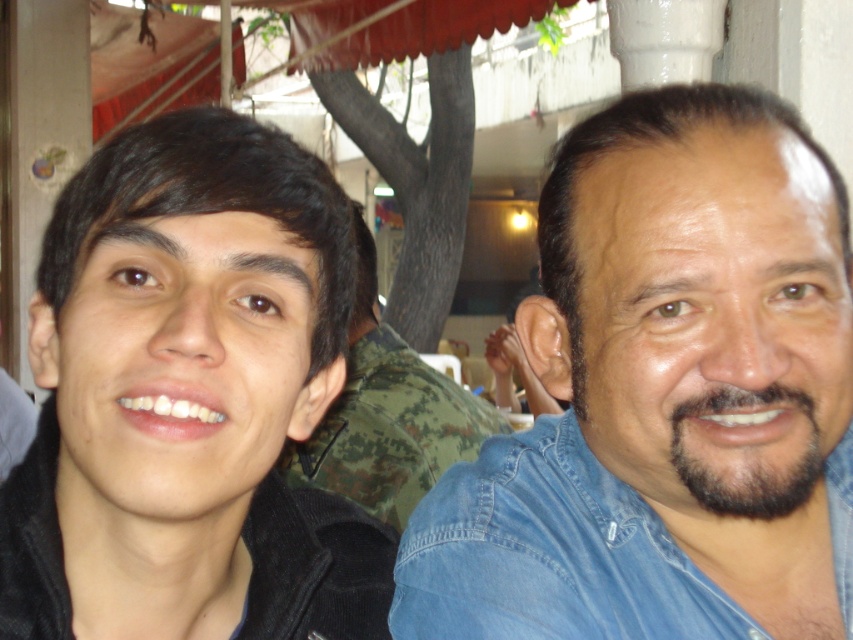
Is the position of blue denim shirt at right more distant than that of black matte jacket at left?

That is True.

Which is behind, point (614, 241) or point (241, 257)?

Point (614, 241)

Which is behind, point (753, 625) or point (105, 436)?

The point (753, 625) is more distant.

I want to click on blue denim shirt at right, so click(x=665, y=396).

Between black matte jacket at left and camouflage fabric shirt at center, which one appears on the right side from the viewer's perspective?

camouflage fabric shirt at center

Based on the photo, is black matte jacket at left wider than camouflage fabric shirt at center?

No.

Which is behind, point (187, 628) or point (473, 424)?

Positioned behind is point (473, 424).

Identify the location of black matte jacket at left. This screenshot has width=853, height=640. (189, 397).

From the picture: Can you confirm if blue denim shirt at right is bigger than camouflage fabric shirt at center?

Incorrect, blue denim shirt at right is not larger than camouflage fabric shirt at center.

Does blue denim shirt at right appear on the left side of camouflage fabric shirt at center?

No, blue denim shirt at right is not to the left of camouflage fabric shirt at center.

Who is more distant from viewer, (544, 452) or (337, 449)?

Point (337, 449)

This screenshot has width=853, height=640. Find the location of `blue denim shirt at right`. blue denim shirt at right is located at coordinates (665, 396).